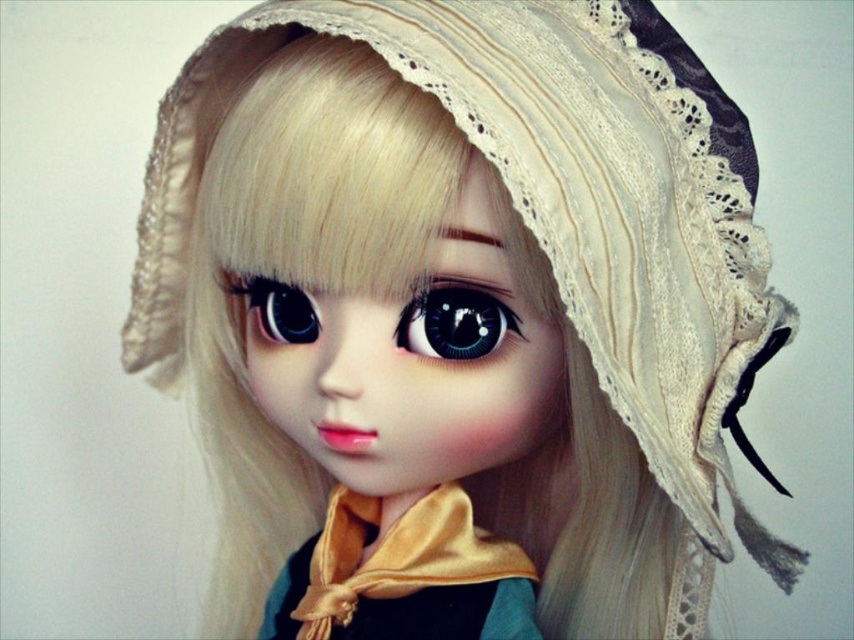
Question: Which is farther from the gold satin scarf at center?

Choices:
 (A) glossy black eye at center
 (B) satin eye at center

Answer: (A)

Question: Is glossy black eye at center closer to the viewer compared to satin eye at center?

Choices:
 (A) no
 (B) yes

Answer: (B)

Question: Which point is closer to the camera?

Choices:
 (A) gold satin scarf at center
 (B) satin eye at center
 (C) glossy black eye at center

Answer: (C)

Question: Does gold satin scarf at center come in front of satin eye at center?

Choices:
 (A) yes
 (B) no

Answer: (B)

Question: Which point is farther to the camera?

Choices:
 (A) gold satin scarf at center
 (B) satin eye at center
 (C) glossy black eye at center

Answer: (A)

Question: Is gold satin scarf at center bigger than glossy black eye at center?

Choices:
 (A) yes
 (B) no

Answer: (A)